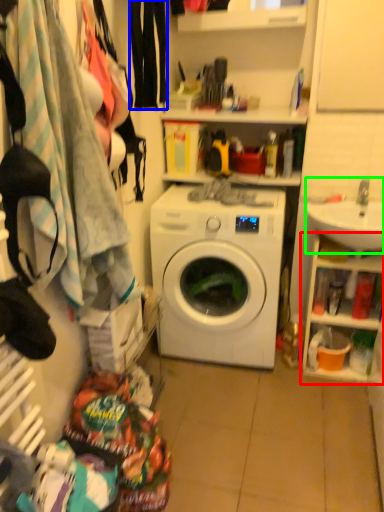
Question: Considering the real-world distances, which object is closest to cabinet (highlighted by a red box)? clothing (highlighted by a blue box) or sink (highlighted by a green box).

Choices:
 (A) clothing
 (B) sink

Answer: (B)